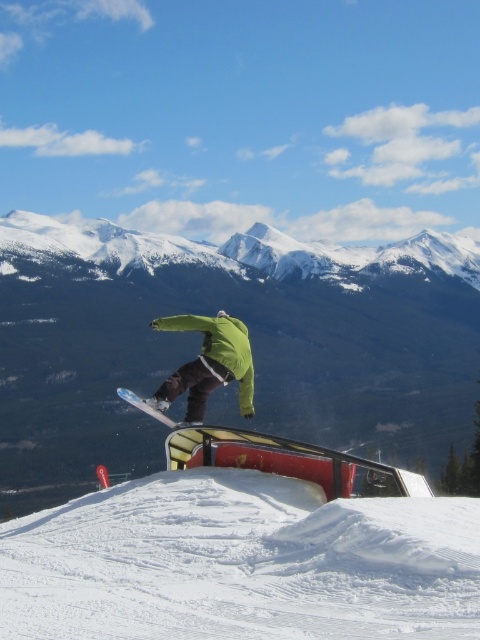
Question: Which object is positioned farthest from the green matte snowboarder at center?

Choices:
 (A) white matte snowboard at center
 (B) white fluffy snow at center

Answer: (A)

Question: Which of the following is the closest to the observer?

Choices:
 (A) (144, 556)
 (B) (235, 352)

Answer: (A)

Question: Which object appears farthest from the camera in this image?

Choices:
 (A) white matte snowboard at center
 (B) white fluffy snow at center
 (C) green matte snowboarder at center

Answer: (A)

Question: Can you confirm if white fluffy snow at center is wider than green matte snowboarder at center?

Choices:
 (A) yes
 (B) no

Answer: (A)

Question: Is white fluffy snow at center to the right of white matte snowboard at center from the viewer's perspective?

Choices:
 (A) yes
 (B) no

Answer: (A)

Question: In this image, where is white fluffy snow at center located relative to white matte snowboard at center?

Choices:
 (A) above
 (B) below

Answer: (A)